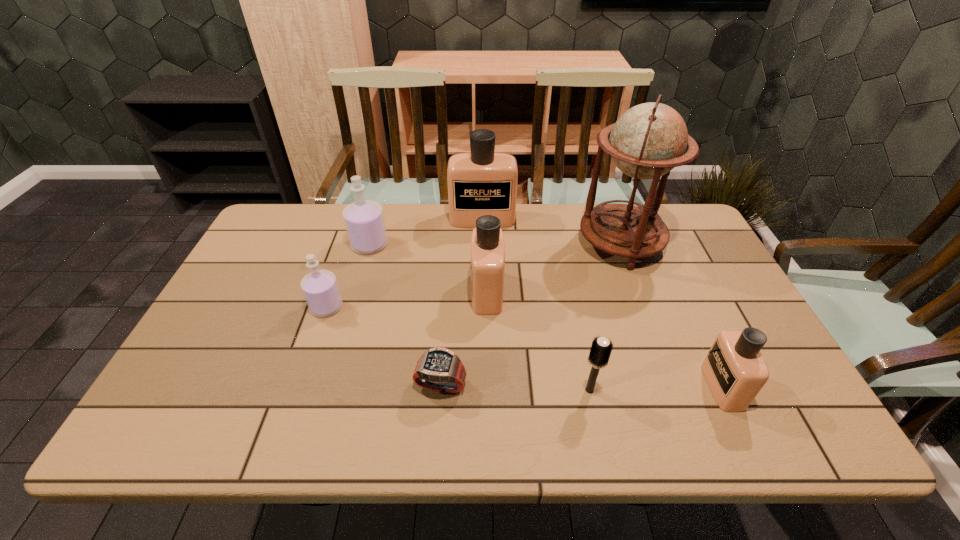
This screenshot has width=960, height=540. I want to click on the shortest object, so click(439, 369).

Find the location of a particular element. Image resolution: width=960 pixels, height=540 pixels. watch is located at coordinates (439, 369).

Identify the location of blank space located 0.370m on the surface of the globe. This screenshot has width=960, height=540. (461, 244).

Identify the location of vacant region located on the surface of the globe. (483, 244).

You are a GUI agent. You are given a task and a screenshot of the screen. Output one action in this format:
    pyautogui.click(x=<x>, y=<y>)
    Task: Click on the vacant space located on the surface of the globe
    This screenshot has width=960, height=540.
    Given the screenshot: What is the action you would take?
    pyautogui.click(x=464, y=244)

The height and width of the screenshot is (540, 960). What are the coordinates of `vacant region located 0.130m on the front label of the tallest perfume` in the screenshot? It's located at (483, 254).

The height and width of the screenshot is (540, 960). What are the coordinates of `vacant region located 0.090m on the front label of the second smallest beige perfume` in the screenshot? It's located at (439, 292).

Locate an element on the screen. This screenshot has width=960, height=540. vacant space located on the front label of the second smallest beige perfume is located at coordinates (349, 292).

The width and height of the screenshot is (960, 540). Identify the location of vacant region located 0.050m on the front label of the second smallest beige perfume. (453, 292).

Where is `vacant position located 0.200m on the right of the farther purple perfume`? This screenshot has width=960, height=540. vacant position located 0.200m on the right of the farther purple perfume is located at coordinates (452, 245).